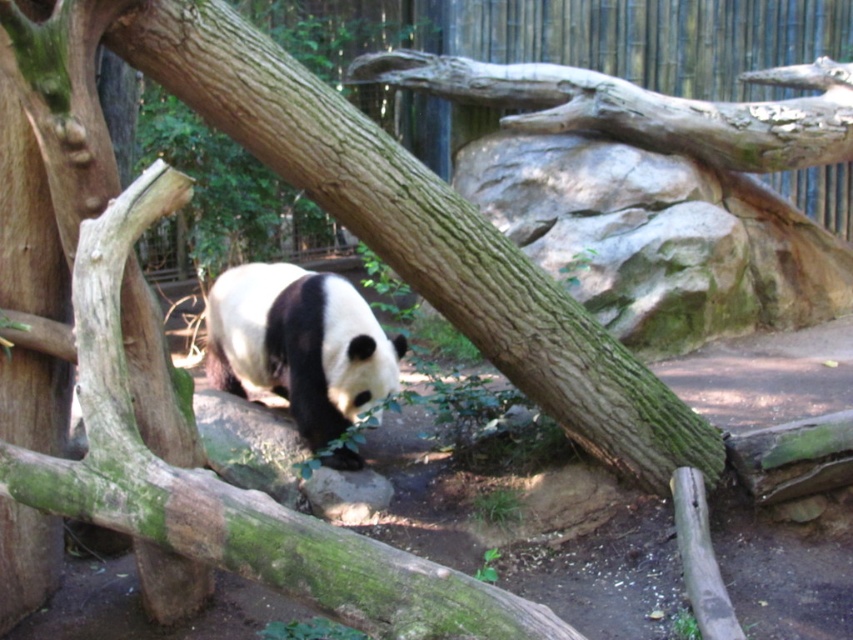
Question: Which of the following is the closest to the observer?

Choices:
 (A) (505, 90)
 (B) (277, 317)

Answer: (B)

Question: Which point is farther from the camera taking this photo?

Choices:
 (A) (521, 116)
 (B) (378, 372)

Answer: (A)

Question: Can you confirm if smooth brown branch at upper center is positioned to the right of black fuzzy panda at center?

Choices:
 (A) yes
 (B) no

Answer: (A)

Question: In this image, where is smooth brown branch at upper center located relative to black fuzzy panda at center?

Choices:
 (A) left
 (B) right

Answer: (B)

Question: Where is smooth brown branch at upper center located in relation to black fuzzy panda at center in the image?

Choices:
 (A) left
 (B) right

Answer: (B)